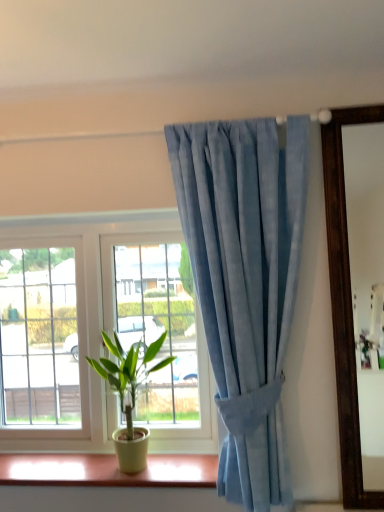
Where is `free area below green matte plant at lower left (from a real-world perspective)`? This screenshot has height=512, width=384. free area below green matte plant at lower left (from a real-world perspective) is located at coordinates (123, 467).